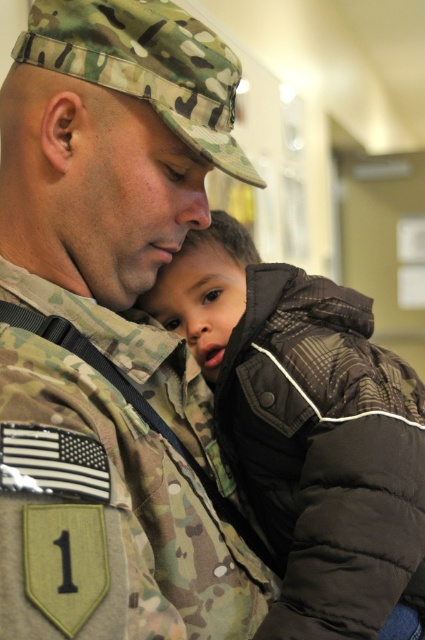
Based on the scene description, can you determine which object is positioned higher between the camo uniform at center and the brown quilted jacket at center?

The camo uniform at center is located above the brown quilted jacket at center, so the camo uniform at center is positioned higher.

You are a photographer adjusting your camera settings to focus on the point at coordinates point (116, 180). Based on the scene description, where is this point located?

The point (116, 180) is located on the camo uniform at center.